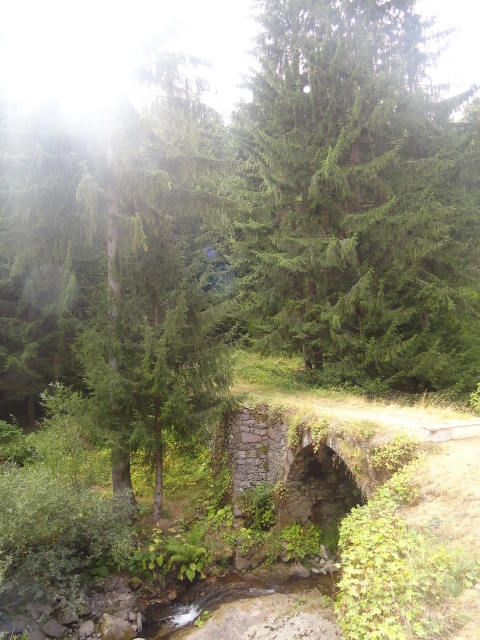
Question: Which object appears closest to the camera in this image?

Choices:
 (A) rusty stone bridge at center
 (B) green matte tree at center

Answer: (A)

Question: Which of these objects is positioned closest to the green needle-like at center?

Choices:
 (A) green matte tree at center
 (B) rusty stone bridge at center

Answer: (A)

Question: Which object is positioned closest to the green matte tree at center?

Choices:
 (A) green needle-like at center
 (B) rusty stone bridge at center

Answer: (A)

Question: From the image, what is the correct spatial relationship of green needle-like at center in relation to rusty stone bridge at center?

Choices:
 (A) above
 (B) below

Answer: (A)

Question: Does green needle-like at center appear over rusty stone bridge at center?

Choices:
 (A) no
 (B) yes

Answer: (B)

Question: Is green needle-like at center further to camera compared to green matte tree at center?

Choices:
 (A) no
 (B) yes

Answer: (B)